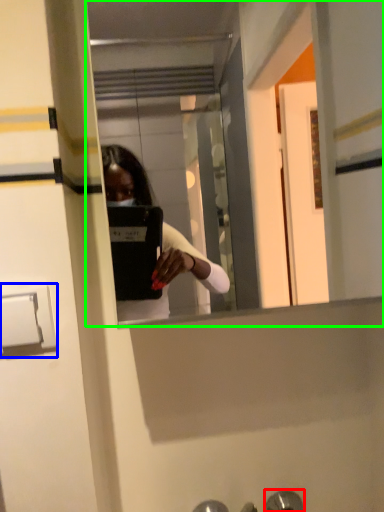
Question: Which is nearer to the door handle (highlighted by a red box)? door handle (highlighted by a blue box) or mirror (highlighted by a green box).

Choices:
 (A) door handle
 (B) mirror

Answer: (A)